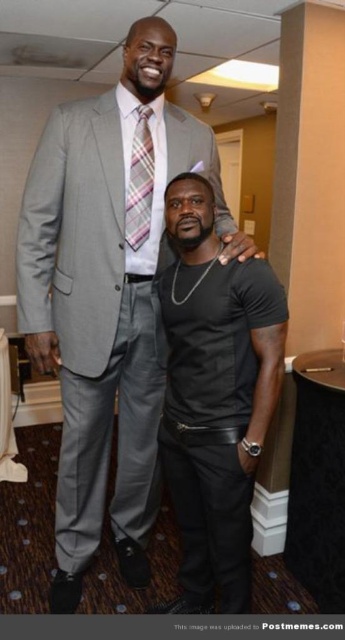
Question: Which of the following is the farthest from the observer?

Choices:
 (A) matte gray suit at center
 (B) black matte t-shirt at center

Answer: (A)

Question: Is black matte t-shirt at center positioned at the back of plaid fabric tie at upper center?

Choices:
 (A) yes
 (B) no

Answer: (B)

Question: Which of these objects is positioned closest to the matte gray suit at center?

Choices:
 (A) black matte t-shirt at center
 (B) plaid fabric tie at upper center

Answer: (B)

Question: In this image, where is matte gray suit at center located relative to black matte t-shirt at center?

Choices:
 (A) left
 (B) right

Answer: (A)

Question: Which point is closer to the camera?

Choices:
 (A) matte gray suit at center
 (B) black matte t-shirt at center

Answer: (B)

Question: Can you confirm if matte gray suit at center is positioned to the left of plaid fabric tie at upper center?

Choices:
 (A) no
 (B) yes

Answer: (B)